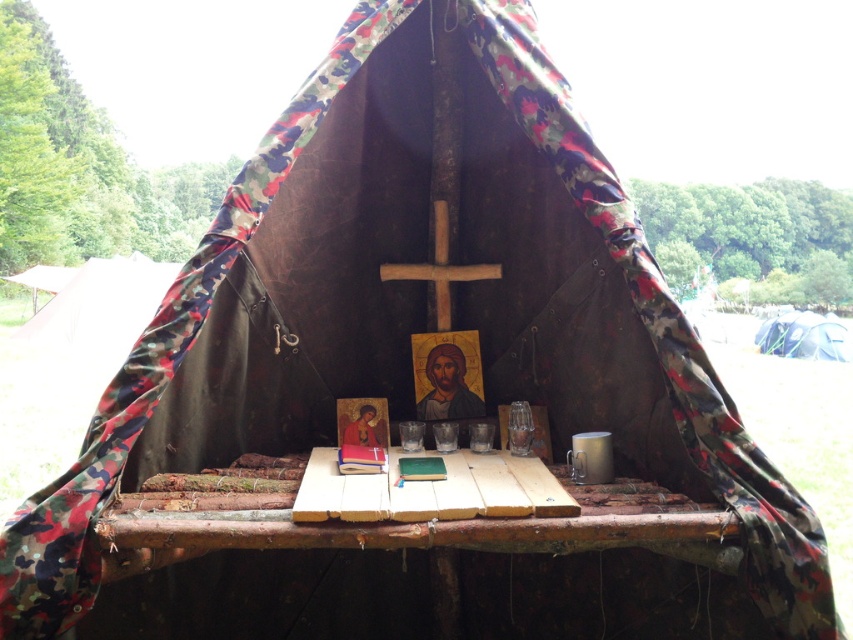
You are setting up a camping site and have two tents to choose from. The camo fabric tent at left and the white canvas tent at right. Based on the scene description, which tent would you choose if you want a wider shelter for more people?

The camo fabric tent at left is wider than the white canvas tent at right, so choosing the camo fabric tent at left would provide a wider shelter for more people.

You are standing inside the tent and want to place a bouquet of flowers on the wooden picnic table at center. To ensure you don not accidentally place them on the camo fabric tent at left, which object should you aim for that is nearer to you?

The wooden picnic table at center is closer to the viewer than the camo fabric tent at left, so you should aim for the wooden picnic table at center as it is nearer.